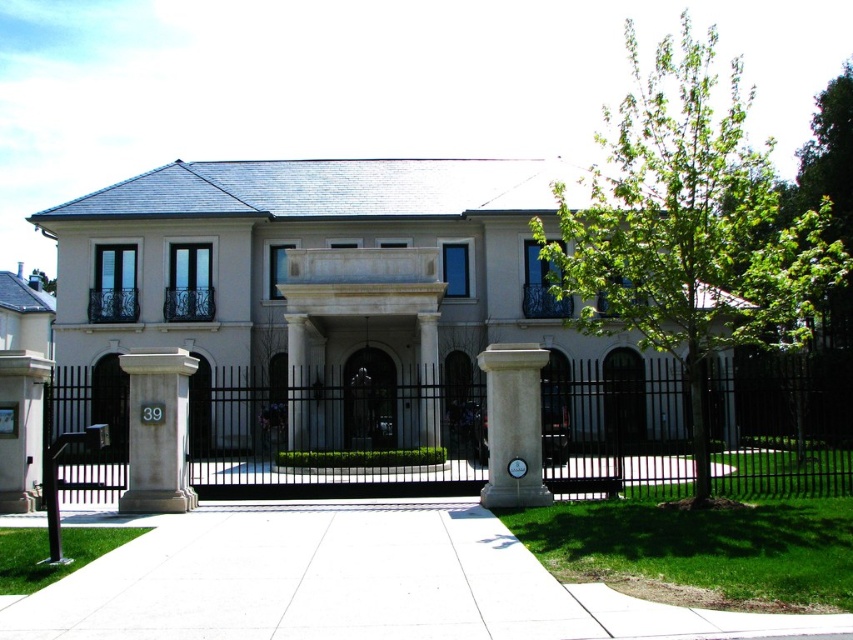
Where is `black metal fence at center`? Image resolution: width=853 pixels, height=640 pixels. black metal fence at center is located at coordinates (334, 436).

Can you confirm if black metal fence at center is taller than white stone column at center?

Indeed, black metal fence at center has a greater height compared to white stone column at center.

Measure the distance between point (575,436) and camera.

Point (575,436) and camera are 26.26 meters apart.

At what (x,y) coordinates should I click in order to perform the action: click on black metal fence at center. Please return your answer as a coordinate pair (x, y). The width and height of the screenshot is (853, 640). Looking at the image, I should click on (334, 436).

The height and width of the screenshot is (640, 853). What do you see at coordinates (350, 582) in the screenshot? I see `white concrete pavement at center` at bounding box center [350, 582].

In the scene shown: Can you confirm if white concrete pavement at center is taller than white stone pillar at center?

No, white concrete pavement at center is not taller than white stone pillar at center.

The height and width of the screenshot is (640, 853). Describe the element at coordinates (350, 582) in the screenshot. I see `white concrete pavement at center` at that location.

What are the coordinates of `white concrete pavement at center` in the screenshot? It's located at (350, 582).

Locate an element on the screen. beige stone mansion at center is located at coordinates (317, 266).

Is point (213, 264) positioned after point (833, 257)?

Yes, point (213, 264) is behind point (833, 257).

Where is `beige stone mansion at center`? beige stone mansion at center is located at coordinates (317, 266).

Locate an element on the screen. Image resolution: width=853 pixels, height=640 pixels. beige stone mansion at center is located at coordinates (317, 266).